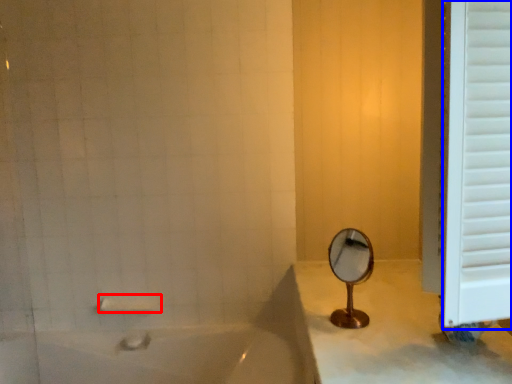
Question: Which of the following is the farthest to the observer, towel bar (highlighted by a red box) or window frame (highlighted by a blue box)?

Choices:
 (A) towel bar
 (B) window frame

Answer: (A)